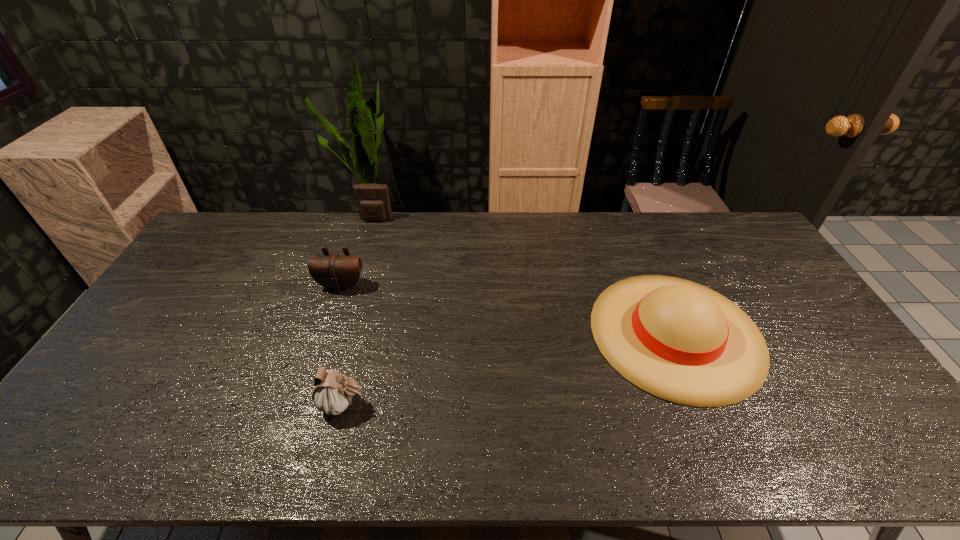
Identify the location of the farthest pouch. (373, 202).

Find the location of a particular element. The height and width of the screenshot is (540, 960). the rightmost object is located at coordinates 681,341.

Image resolution: width=960 pixels, height=540 pixels. What are the coordinates of `the second farthest pouch` in the screenshot? It's located at (336, 272).

In order to click on the nearest pouch in this screenshot , I will do `click(333, 392)`.

Find the location of `blank area located with an open flap on the farthest pouch`. blank area located with an open flap on the farthest pouch is located at coordinates (364, 262).

What are the coordinates of `vacant space located on the left of the sombrero` in the screenshot? It's located at pos(540,333).

Locate an element on the screen. The image size is (960, 540). free region located 0.150m with the flap open on the second nearest pouch is located at coordinates (326, 331).

Where is `blank area located on the front-facing side of the nearest pouch`? Image resolution: width=960 pixels, height=540 pixels. blank area located on the front-facing side of the nearest pouch is located at coordinates (506, 404).

Identify the location of object that is positioned at the far edge. (373, 202).

At what (x,y) coordinates should I click in order to perform the action: click on vacant space at the far edge of the desktop. Please return your answer as a coordinate pair (x, y). Looking at the image, I should click on (621, 231).